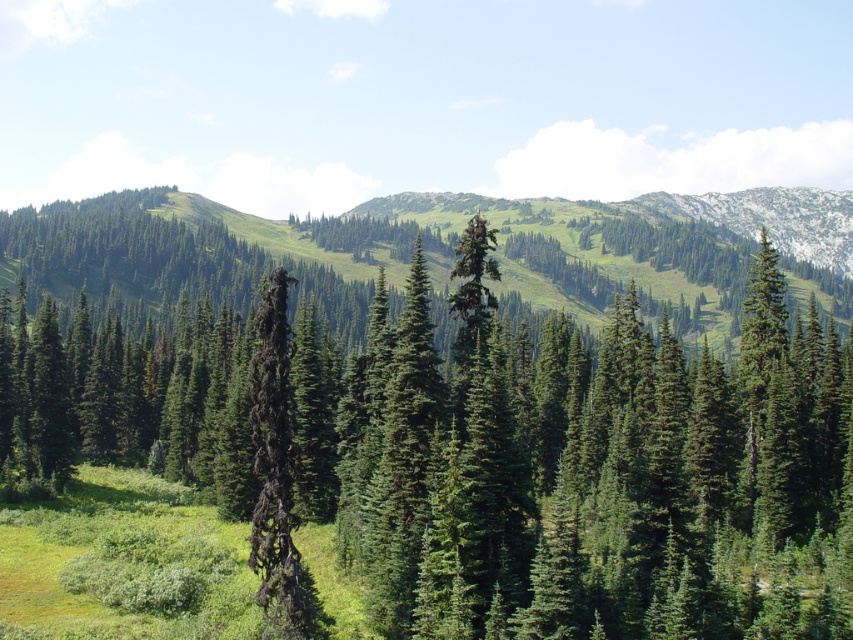
Question: Does green matte tree at center appear under dark brown/charred wood tree at center?

Choices:
 (A) yes
 (B) no

Answer: (B)

Question: Where is green matte tree at center located in relation to dark brown/charred wood tree at center in the image?

Choices:
 (A) right
 (B) left

Answer: (A)

Question: Which point appears closest to the camera in this image?

Choices:
 (A) (544, 518)
 (B) (258, 596)

Answer: (B)

Question: Which object appears farthest from the camera in this image?

Choices:
 (A) dark brown/charred wood tree at center
 (B) green matte tree at center

Answer: (B)

Question: Which of the following is the farthest from the observer?

Choices:
 (A) green matte tree at center
 (B) dark brown/charred wood tree at center

Answer: (A)

Question: Is green matte tree at center positioned behind dark brown/charred wood tree at center?

Choices:
 (A) yes
 (B) no

Answer: (A)